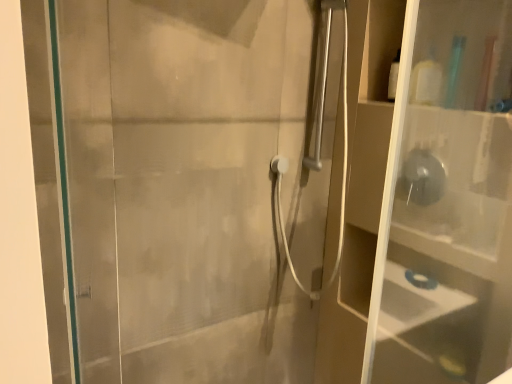
What is the approximate height of white matte bottle at upper right?

white matte bottle at upper right is 7.28 inches in height.

In order to click on transparent plastic shelf at right in this screenshot , I will do `click(447, 206)`.

The width and height of the screenshot is (512, 384). I want to click on transparent glass screen door at left, so click(x=188, y=186).

Where is `white matte bottle at upper right`? This screenshot has width=512, height=384. white matte bottle at upper right is located at coordinates (426, 80).

Does point (433, 64) appear closer or farther from the camera than point (410, 245)?

Point (433, 64) is closer to the camera than point (410, 245).

Between white matte bottle at upper right and transparent plastic shelf at right, which one appears on the left side from the viewer's perspective?

white matte bottle at upper right.

Is white matte bottle at upper right wider or thinner than transparent plastic shelf at right?

In the image, white matte bottle at upper right appears to be wider than transparent plastic shelf at right.

Based on the photo, relative to transparent plastic shelf at right, is white matte bottle at upper right in front or behind?

Visually, white matte bottle at upper right is located behind transparent plastic shelf at right.

From the image's perspective, who appears lower, transparent plastic shelf at right or white matte bottle at upper right?

transparent plastic shelf at right.

From a real-world perspective, is transparent plastic shelf at right physically located above or below white matte bottle at upper right?

transparent plastic shelf at right is situated lower than white matte bottle at upper right in the real world.

Considering the positions of point (456, 305) and point (435, 72), is point (456, 305) closer or farther from the camera than point (435, 72)?

Point (456, 305) appears to be closer to the viewer than point (435, 72).

Is transparent plastic shelf at right inside the boundaries of white matte bottle at upper right, or outside?

transparent plastic shelf at right is outside white matte bottle at upper right.

From the image's perspective, is transparent glass screen door at left located above or below transparent plastic shelf at right?

transparent glass screen door at left is situated higher than transparent plastic shelf at right in the image.

Is the depth of transparent glass screen door at left greater than that of transparent plastic shelf at right?

Yes, it is.

Is transparent glass screen door at left facing towards transparent plastic shelf at right?

No, transparent glass screen door at left is not turned towards transparent plastic shelf at right.

Does transparent glass screen door at left have a lesser height compared to transparent plastic shelf at right?

In fact, transparent glass screen door at left may be taller than transparent plastic shelf at right.

Is transparent plastic shelf at right oriented away from transparent glass screen door at left?

No, transparent plastic shelf at right is not facing the opposite direction of transparent glass screen door at left.

From a real-world perspective, which object stands above the other?

In real-world perspective, transparent plastic shelf at right is above.

Is transparent plastic shelf at right closer to camera compared to transparent glass screen door at left?

Yes.

Considering the positions of objects transparent plastic shelf at right and transparent glass screen door at left in the image provided, who is more to the right, transparent plastic shelf at right or transparent glass screen door at left?

Positioned to the right is transparent plastic shelf at right.

Locate an element on the screen. Image resolution: width=512 pixels, height=384 pixels. screen door directly beneath the white matte bottle at upper right (from a real-world perspective) is located at coordinates (188, 186).

Considering the relative sizes of transparent glass screen door at left and white matte bottle at upper right in the image provided, is transparent glass screen door at left thinner than white matte bottle at upper right?

Correct, the width of transparent glass screen door at left is less than that of white matte bottle at upper right.

Measure the distance between transparent glass screen door at left and white matte bottle at upper right.

transparent glass screen door at left is 33.55 inches from white matte bottle at upper right.

Can you confirm if white matte bottle at upper right is shorter than transparent glass screen door at left?

Yes.

Considering the sizes of objects white matte bottle at upper right and transparent glass screen door at left in the image provided, who is wider, white matte bottle at upper right or transparent glass screen door at left?

Wider between the two is white matte bottle at upper right.

Based on the photo, would you say white matte bottle at upper right is a long distance from transparent glass screen door at left?

That's not correct — white matte bottle at upper right is a little close to transparent glass screen door at left.

The image size is (512, 384). I want to click on glass box below the white matte bottle at upper right (from the image's perspective), so click(447, 206).

Identify the location of toiletry lying above the transparent plastic shelf at right (from the image's perspective). This screenshot has height=384, width=512. pos(426,80).

Looking at the image, which one is located further to white matte bottle at upper right, transparent glass screen door at left or transparent plastic shelf at right?

transparent glass screen door at left lies further to white matte bottle at upper right than the other object.

When comparing their distances from transparent glass screen door at left, does transparent plastic shelf at right or white matte bottle at upper right seem further?

white matte bottle at upper right is further to transparent glass screen door at left.

Looking at the image, which one is located further to transparent plastic shelf at right, transparent glass screen door at left or white matte bottle at upper right?

Among the two, transparent glass screen door at left is located further to transparent plastic shelf at right.

When comparing their distances from transparent glass screen door at left, does white matte bottle at upper right or transparent plastic shelf at right seem further?

The object further to transparent glass screen door at left is white matte bottle at upper right.

Looking at the image, which one is located closer to white matte bottle at upper right, transparent plastic shelf at right or transparent glass screen door at left?

transparent plastic shelf at right lies closer to white matte bottle at upper right than the other object.

Looking at the image, which one is located closer to transparent plastic shelf at right, white matte bottle at upper right or transparent glass screen door at left?

white matte bottle at upper right is closer to transparent plastic shelf at right.

Where is `toiletry situated between transparent glass screen door at left and transparent plastic shelf at right from left to right`? The width and height of the screenshot is (512, 384). toiletry situated between transparent glass screen door at left and transparent plastic shelf at right from left to right is located at coordinates (426, 80).